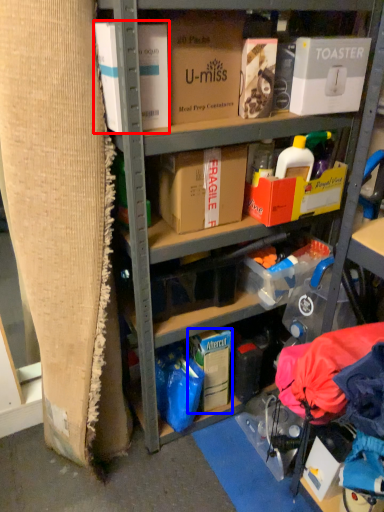
Question: Which of the following is the farthest to the observer, box (highlighted by a red box) or storage box (highlighted by a blue box)?

Choices:
 (A) box
 (B) storage box

Answer: (B)